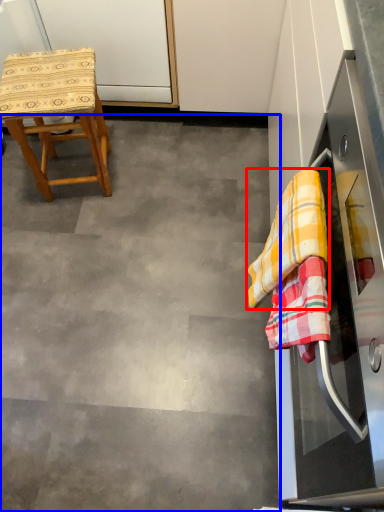
Question: Which point is further to the camera, clothe (highlighted by a red box) or concrete (highlighted by a blue box)?

Choices:
 (A) clothe
 (B) concrete

Answer: (B)